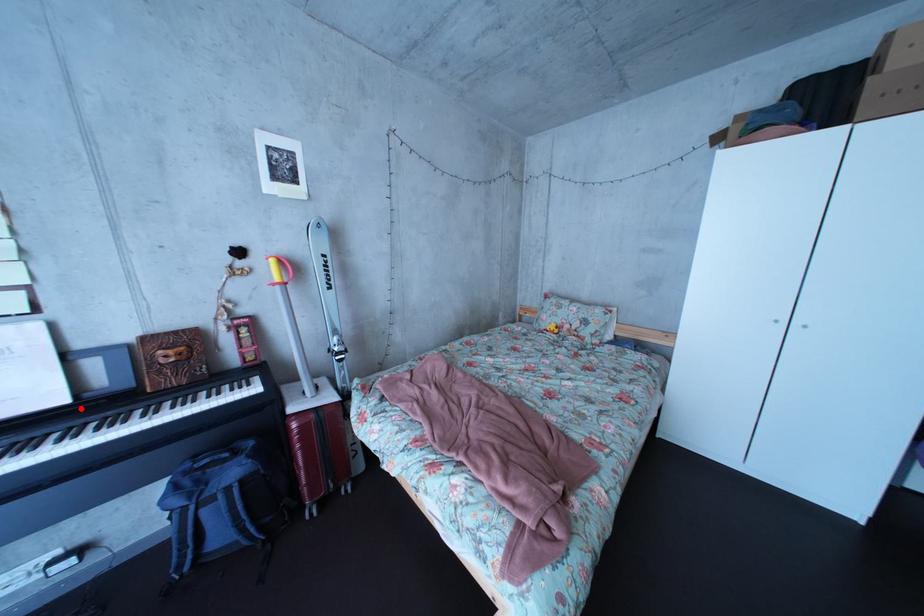
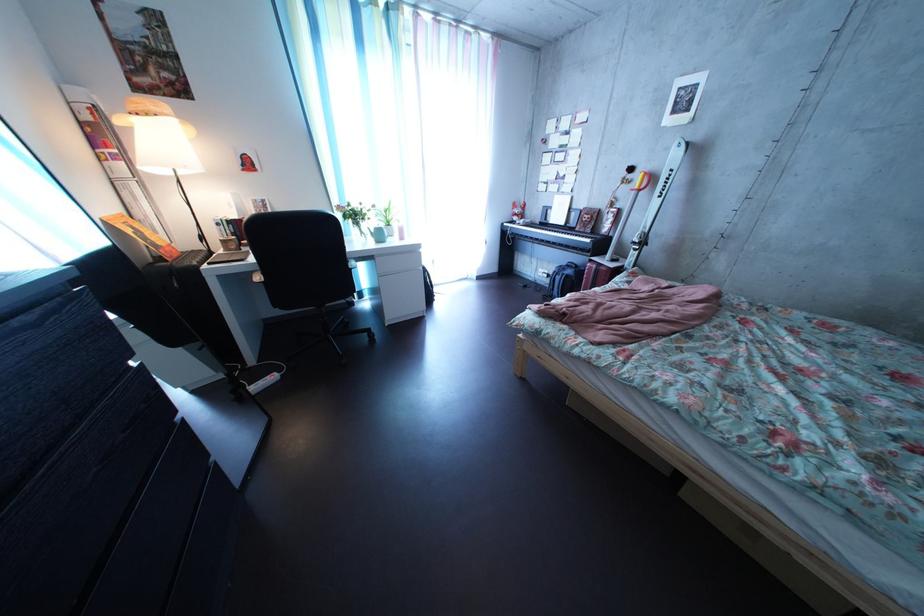
Find the pixel in the second image that matches the highlighted location in the first image.

(577, 232)